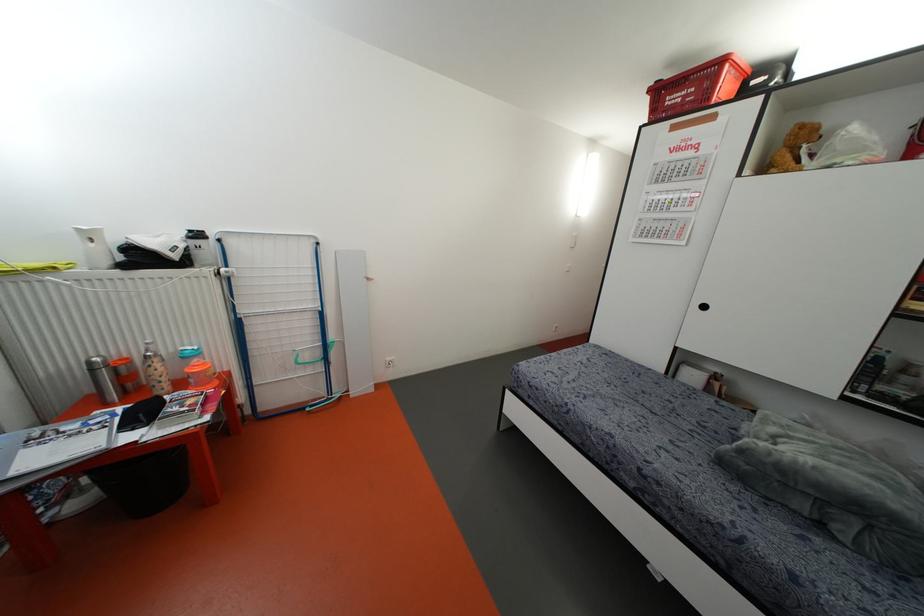
Find where to pull the black cabinet handle. Please return your answer as a coordinate pair (x, y).

(702, 306)